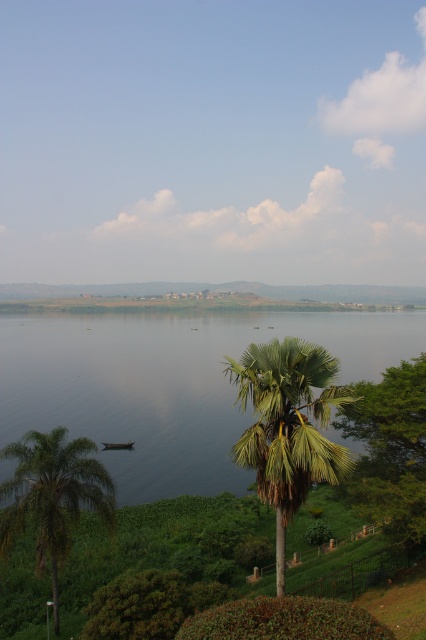
Question: Does transparent water at center appear over dark green wooden boat at lower left?

Choices:
 (A) no
 (B) yes

Answer: (B)

Question: Among these objects, which one is farthest from the camera?

Choices:
 (A) green leafy tree at lower right
 (B) dark green wooden boat at lower left

Answer: (B)

Question: Observing the image, what is the correct spatial positioning of transparent water at center in reference to green leafy palm tree at center?

Choices:
 (A) below
 (B) above

Answer: (B)

Question: Is green leafy palm tree at center closer to the viewer compared to green leafy palm tree at lower left?

Choices:
 (A) yes
 (B) no

Answer: (A)

Question: Estimate the real-world distances between objects in this image. Which object is closer to the green leafy palm tree at center?

Choices:
 (A) dark green wooden boat at lower left
 (B) transparent water at center
 (C) green leafy tree at lower right
 (D) green leafy palm tree at lower left

Answer: (C)

Question: Which object appears closest to the camera in this image?

Choices:
 (A) transparent water at center
 (B) green leafy tree at lower right

Answer: (A)